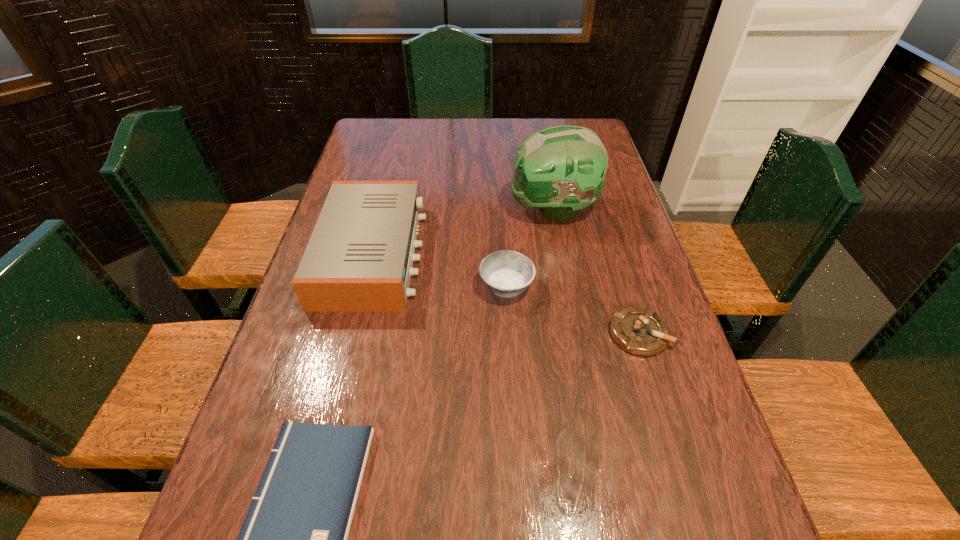
Locate an element on the screen. The width and height of the screenshot is (960, 540). vacant space that satisfies the following two spatial constraints: 1. on the control panel of the radio receiver; 2. on the right side of the fourth tallest object is located at coordinates (354, 333).

You are a GUI agent. You are given a task and a screenshot of the screen. Output one action in this format:
    pyautogui.click(x=<x>, y=<y>)
    Task: Click on the blank space that satisfies the following two spatial constraints: 1. on the control panel of the fourth shortest object; 2. on the back side of the left ashtray
    This screenshot has height=540, width=960.
    Given the screenshot: What is the action you would take?
    pyautogui.click(x=366, y=287)

Identify the location of free location that satisfies the following two spatial constraints: 1. on the control panel of the radio receiver; 2. on the right side of the nearer ashtray. coord(354,333).

Image resolution: width=960 pixels, height=540 pixels. What are the coordinates of `vacant area in the image that satisfies the following two spatial constraints: 1. on the visor of the right ashtray; 2. on the right side of the tallest object` in the screenshot? It's located at point(576,333).